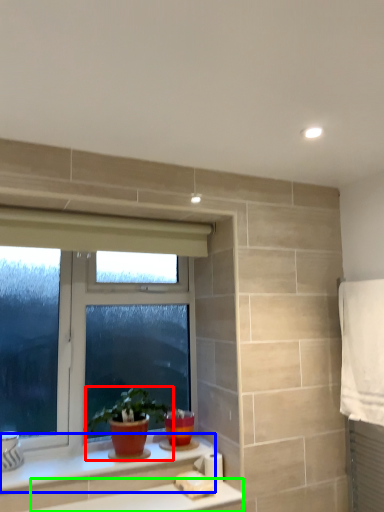
Question: Which is farther away from houseplant (highlighted by a red box)? counter top (highlighted by a blue box) or counter top (highlighted by a green box)?

Choices:
 (A) counter top
 (B) counter top

Answer: (B)